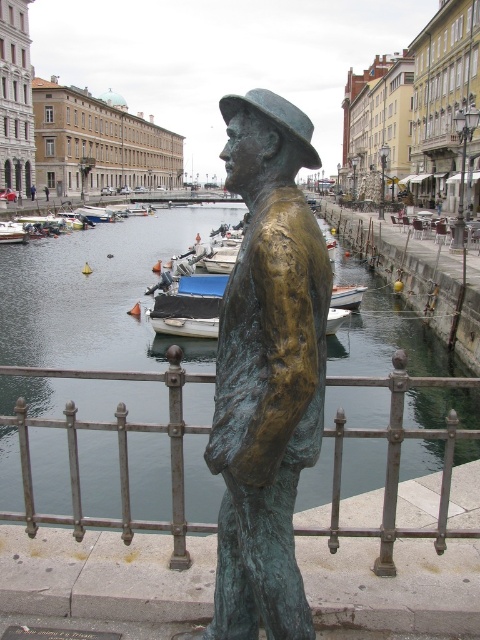
Question: Does bronze statue at center lie behind white wooden boat at lower left?

Choices:
 (A) no
 (B) yes

Answer: (A)

Question: Is greenish-blue water at center positioned behind white wooden boat at lower left?

Choices:
 (A) yes
 (B) no

Answer: (B)

Question: Among these points, which one is farthest from the camera?

Choices:
 (A) (299, 163)
 (B) (6, 234)
 (C) (201, 276)
 (D) (23, 458)

Answer: (B)

Question: Which point appears closest to the camera in this image?

Choices:
 (A) (207, 294)
 (B) (257, 209)
 (C) (453, 385)
 (D) (25, 232)

Answer: (B)

Question: Is the position of greenish-blue water at center more distant than that of bronze statue at center?

Choices:
 (A) yes
 (B) no

Answer: (A)

Question: Which object is positioned farthest from the bronze statue at center?

Choices:
 (A) greenish-blue water at center
 (B) white wooden boat at lower left
 (C) blue matte boat at center

Answer: (B)